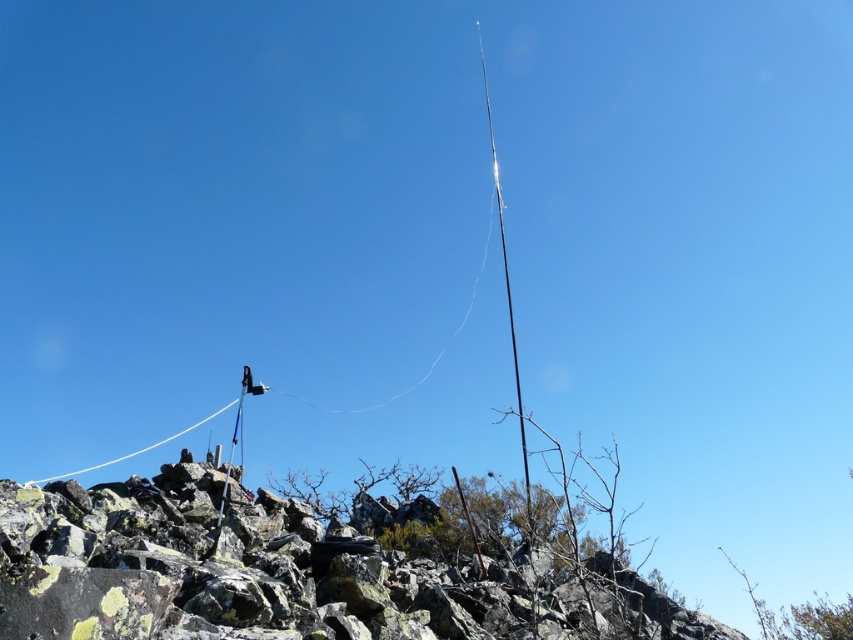
Question: Does rough stone hill at center appear under white string at upper left?

Choices:
 (A) no
 (B) yes

Answer: (A)

Question: Can you confirm if rough stone hill at center is positioned below white string at upper left?

Choices:
 (A) no
 (B) yes

Answer: (A)

Question: Which object appears farthest from the camera in this image?

Choices:
 (A) rough stone hill at center
 (B) white string at upper left

Answer: (B)

Question: Which point is farther from the camera taking this photo?

Choices:
 (A) click(x=234, y=403)
 (B) click(x=398, y=628)

Answer: (A)

Question: Does rough stone hill at center appear under white string at upper left?

Choices:
 (A) yes
 (B) no

Answer: (B)